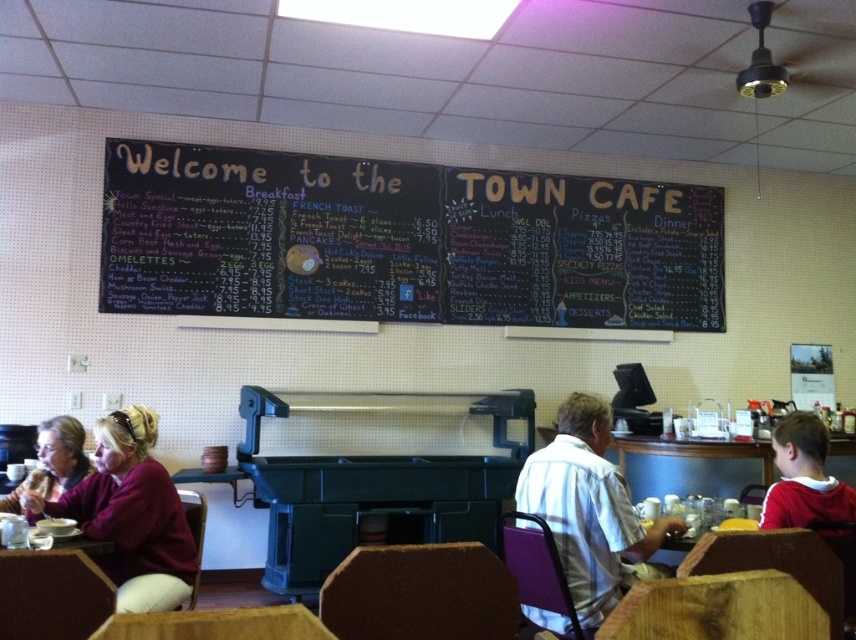
Does white striped shirt at center have a smaller size compared to red fleece jacket at lower right?

No.

Does point (610, 563) come behind point (810, 508)?

That is True.

Find the location of a particular element. The height and width of the screenshot is (640, 856). white striped shirt at center is located at coordinates (589, 509).

Between black chalkboard menu at upper center and matte brown hair at upper left, which one is positioned higher?

black chalkboard menu at upper center

Who is positioned more to the right, black chalkboard menu at upper center or matte brown hair at upper left?

black chalkboard menu at upper center

Does point (444, 232) lie behind point (67, 440)?

Yes, it is behind point (67, 440).

Where is `black chalkboard menu at upper center`? This screenshot has width=856, height=640. black chalkboard menu at upper center is located at coordinates coord(402,241).

Between point (785, 484) and point (74, 445), which one is positioned behind?

Positioned behind is point (74, 445).

Does red fleece jacket at lower right have a lesser height compared to matte brown hair at upper left?

In fact, red fleece jacket at lower right may be taller than matte brown hair at upper left.

Image resolution: width=856 pixels, height=640 pixels. What do you see at coordinates (803, 477) in the screenshot?
I see `red fleece jacket at lower right` at bounding box center [803, 477].

You are a GUI agent. You are given a task and a screenshot of the screen. Output one action in this format:
    pyautogui.click(x=<x>, y=<y>)
    Task: Click on the red fleece jacket at lower right
    
    Given the screenshot: What is the action you would take?
    pyautogui.click(x=803, y=477)